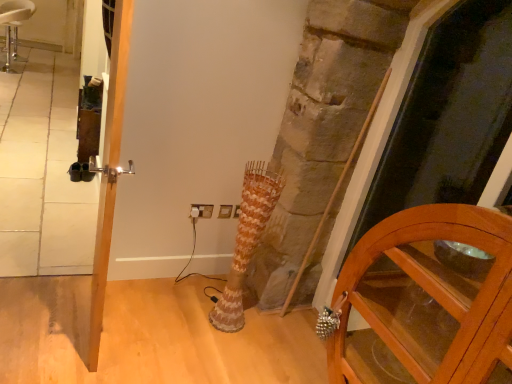
Where is `blank space to the left of polished silver door handle at left`? This screenshot has height=384, width=512. blank space to the left of polished silver door handle at left is located at coordinates (54, 311).